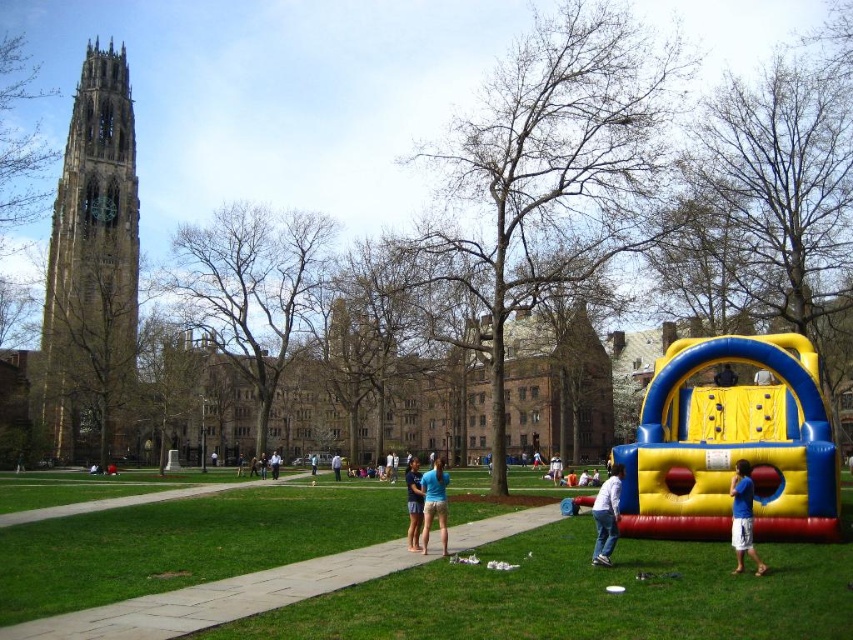
Question: Which point is farther to the camera?

Choices:
 (A) (271, 472)
 (B) (242, 464)

Answer: (B)

Question: Does blue fabric person at lower right have a smaller size compared to blue t-shirt at center?

Choices:
 (A) yes
 (B) no

Answer: (B)

Question: Is green grass at lower center wider than blue fabric bouncy house at center?

Choices:
 (A) no
 (B) yes

Answer: (B)

Question: Which point is closer to the camera?

Choices:
 (A) blue fabric shorts at center
 (B) golden stone tower at upper left

Answer: (A)

Question: Which point is closer to the camera?

Choices:
 (A) (756, 564)
 (B) (331, 460)
 (C) (612, 470)
 (D) (315, 465)

Answer: (A)

Question: In this image, where is golden stone tower at upper left located relative to blue cotton shirt at center?

Choices:
 (A) left
 (B) right

Answer: (A)